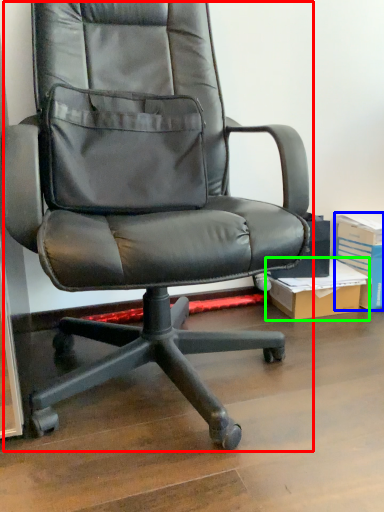
Question: Estimate the real-world distances between objects in this image. Which object is closer to chair (highlighted by a red box), paperback book (highlighted by a blue box) or cardboard box (highlighted by a green box)?

Choices:
 (A) paperback book
 (B) cardboard box

Answer: (B)